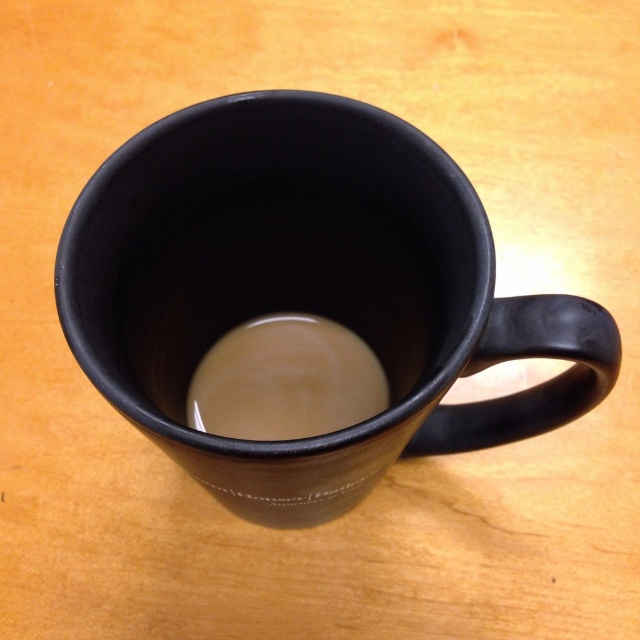
Question: Where is matte black mug at center located in relation to creamy matte coffee at center in the image?

Choices:
 (A) left
 (B) right

Answer: (B)

Question: Which object appears farthest from the camera in this image?

Choices:
 (A) matte black mug at center
 (B) creamy matte coffee at center

Answer: (B)

Question: Can you confirm if matte black mug at center is smaller than creamy matte coffee at center?

Choices:
 (A) yes
 (B) no

Answer: (B)

Question: Among these points, which one is farthest from the camera?

Choices:
 (A) (337, 376)
 (B) (112, 275)

Answer: (A)

Question: Is matte black mug at center bigger than creamy matte coffee at center?

Choices:
 (A) no
 (B) yes

Answer: (B)

Question: Which point is closer to the camera?

Choices:
 (A) (160, 368)
 (B) (256, 440)

Answer: (A)